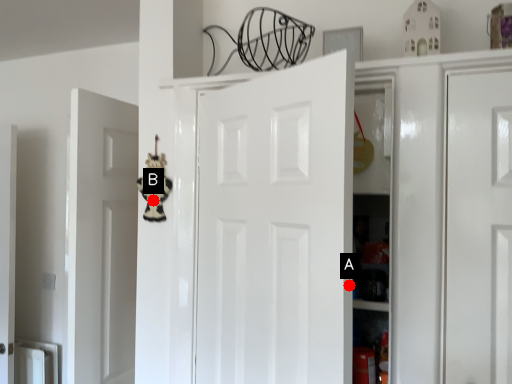
Question: Two points are circled on the image, labeled by A and B beside each circle. Among these points, which one is farthest from the camera?

Choices:
 (A) A is further
 (B) B is further

Answer: (B)